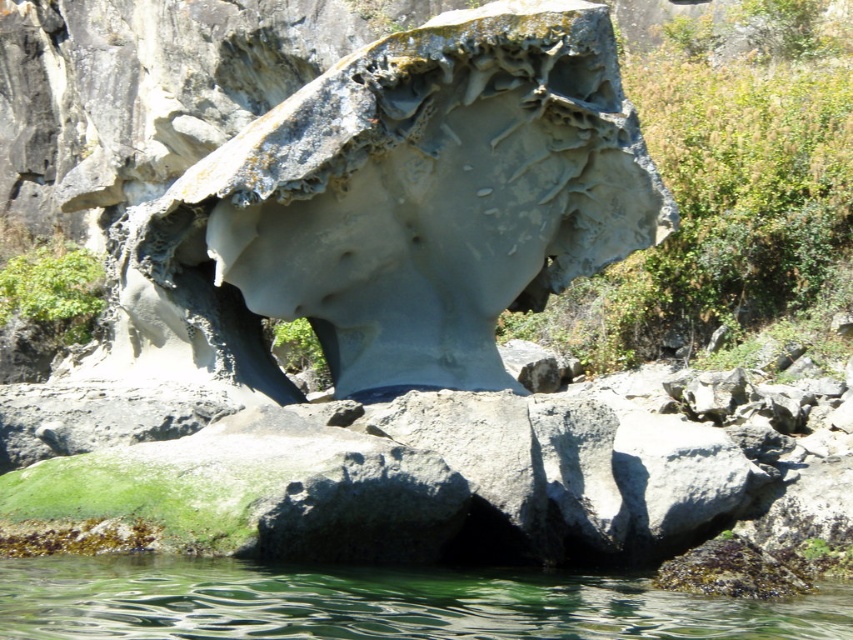
Question: Which of the following is the farthest from the observer?

Choices:
 (A) (538, 49)
 (B) (251, 563)

Answer: (A)

Question: Which point appears farthest from the camera in this image?

Choices:
 (A) (351, 268)
 (B) (51, 595)

Answer: (A)

Question: Does gray stone sculpture at center appear over clear water at lower center?

Choices:
 (A) no
 (B) yes

Answer: (B)

Question: Does gray stone sculpture at center have a larger size compared to clear water at lower center?

Choices:
 (A) yes
 (B) no

Answer: (A)

Question: Does gray stone sculpture at center appear over clear water at lower center?

Choices:
 (A) no
 (B) yes

Answer: (B)